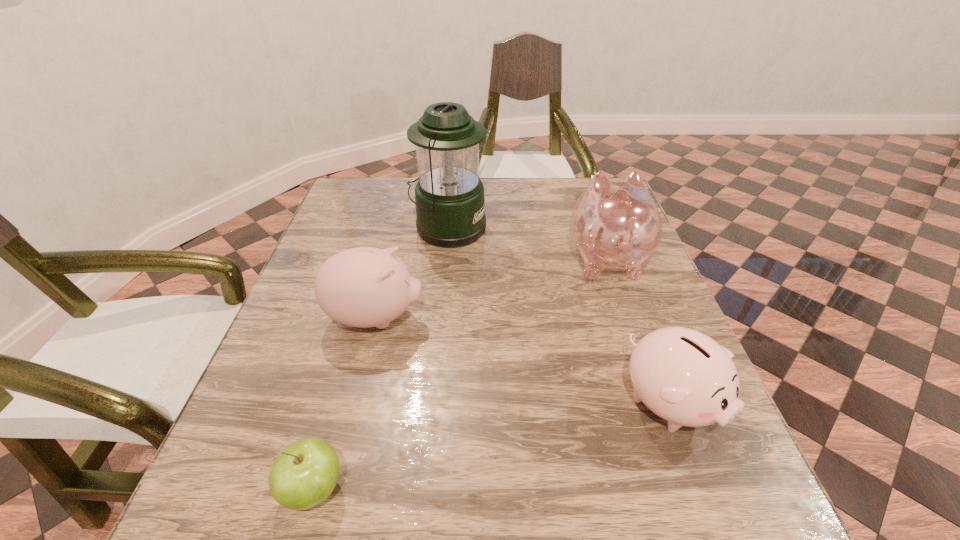
Locate an element on the screen. Image resolution: width=960 pixels, height=540 pixels. lantern is located at coordinates (450, 205).

This screenshot has width=960, height=540. Identify the location of the tallest piggy bank. (615, 225).

Locate an element on the screen. The width and height of the screenshot is (960, 540). the fourth shortest object is located at coordinates (615, 225).

In order to click on the second farthest piggy bank in this screenshot , I will do `click(363, 287)`.

The image size is (960, 540). In order to click on the leftmost piggy bank in this screenshot , I will do [x=363, y=287].

Identify the location of the second nearest object. (685, 377).

Where is `the nearest object`? the nearest object is located at coordinates (304, 474).

The image size is (960, 540). In order to click on apple in this screenshot , I will do `click(304, 474)`.

Locate an element on the screen. The height and width of the screenshot is (540, 960). vacant region located on the right of the lantern is located at coordinates (576, 228).

This screenshot has height=540, width=960. In order to click on vacant region located on the front facing side of the tallest piggy bank in this screenshot , I will do `click(588, 207)`.